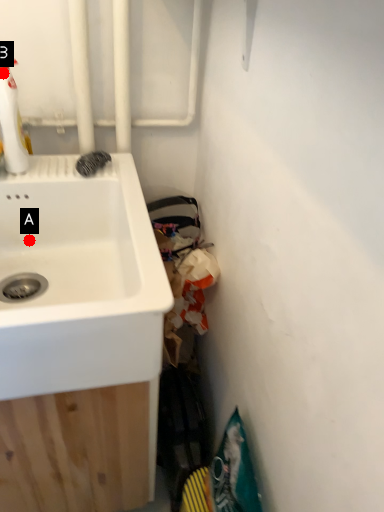
Question: Two points are circled on the image, labeled by A and B beside each circle. Which point is farther to the camera?

Choices:
 (A) A is further
 (B) B is further

Answer: (A)